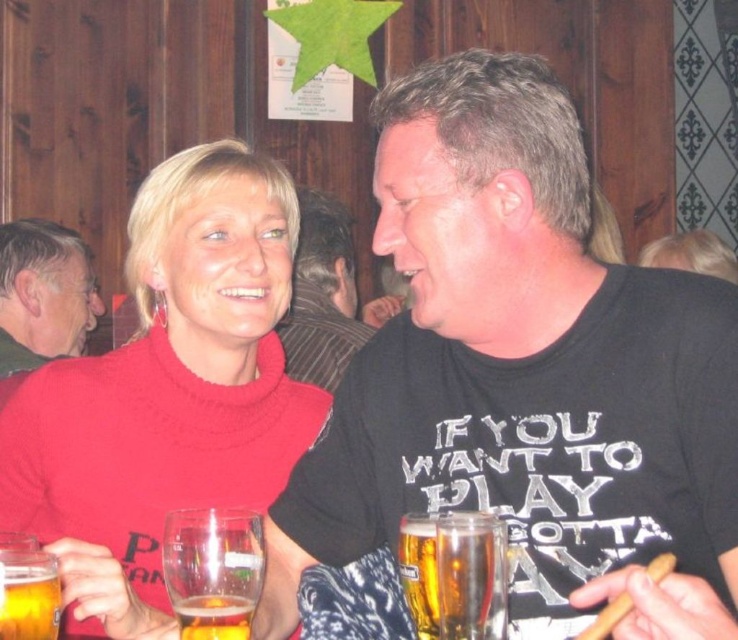
In the scene shown: You are standing at the point with coordinates point (337, 321) and want to move to the point with coordinates point (189, 262). Is the destination point in front of you?

Yes, the point (189, 262) is in front of point (337, 321), so the destination is in front of you.